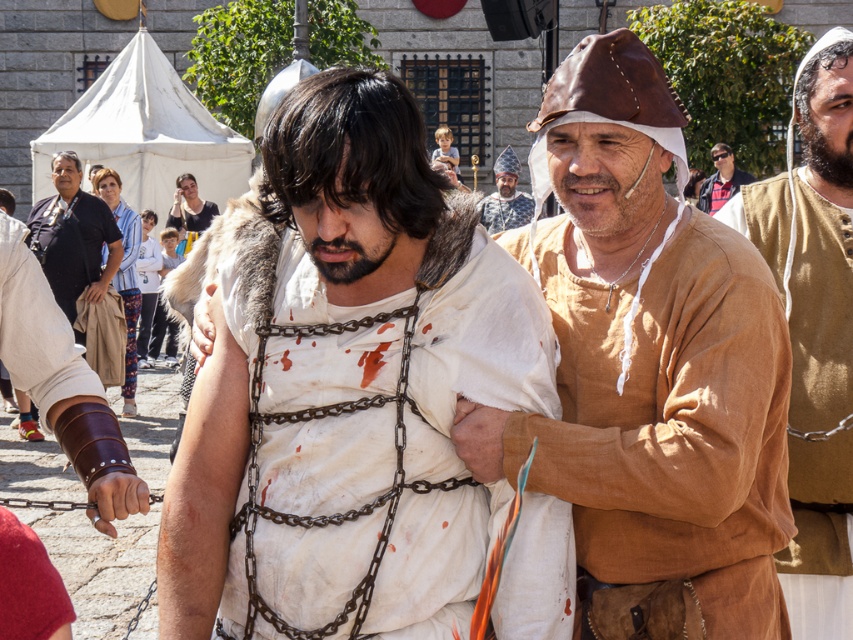
Who is more distant from viewer, [833,308] or [705,208]?

Positioned behind is point [705,208].

Measure the distance between brown linen shirt at right and dark brown leather jacket at upper center.

brown linen shirt at right is 135.51 feet from dark brown leather jacket at upper center.

Is point (810, 369) farther from viewer compared to point (717, 177)?

No, (810, 369) is in front of (717, 177).

Identify the location of brown linen shirt at right. (814, 332).

Between white clothed man at center and red fabric cap at lower left, which one appears on the left side from the viewer's perspective?

Positioned to the left is red fabric cap at lower left.

Is point (231, 214) in front of point (0, 561)?

That is False.

Locate an element on the screen. This screenshot has height=640, width=853. white clothed man at center is located at coordinates (344, 385).

Consider the image. Measure the distance between dark brown leather jacket at center and camera.

dark brown leather jacket at center and camera are 34.30 meters apart.

Is point (103, 273) positioned before point (703, 204)?

That is True.

What do you see at coordinates (73, 237) in the screenshot? I see `dark brown leather jacket at center` at bounding box center [73, 237].

The height and width of the screenshot is (640, 853). Identify the location of dark brown leather jacket at center. (73, 237).